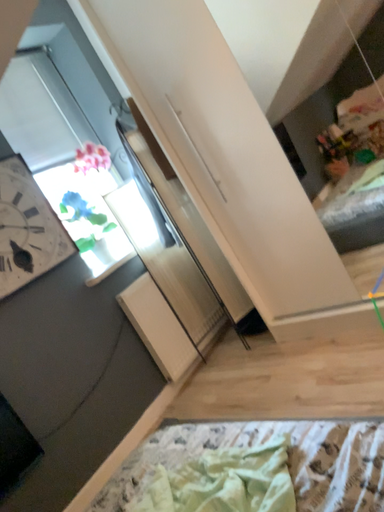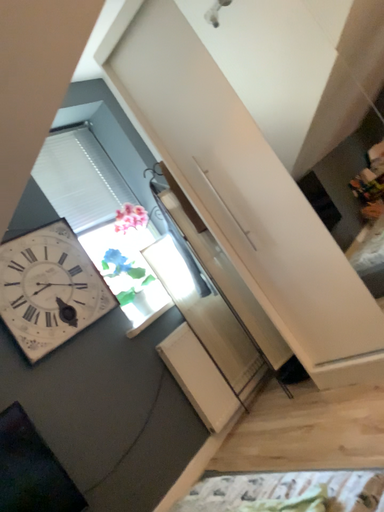
Question: How did the camera likely rotate when shooting the video?

Choices:
 (A) rotated right
 (B) rotated left

Answer: (B)